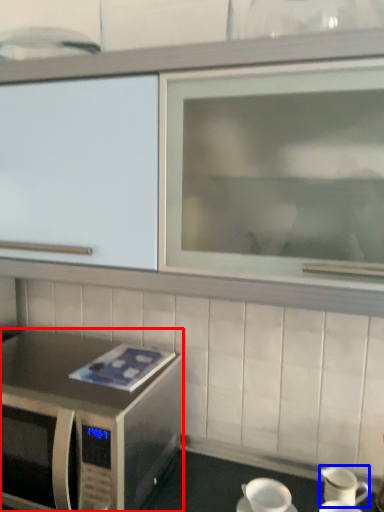
Question: Which object is further to the camera taking this photo, microwave oven (highlighted by a red box) or tableware (highlighted by a blue box)?

Choices:
 (A) microwave oven
 (B) tableware

Answer: (B)